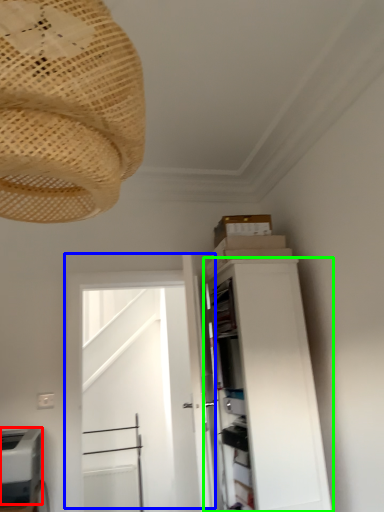
Question: Based on their relative distances, which object is farther from appliance (highlighted by a red box)? Choose from door (highlighted by a blue box) and cabinetry (highlighted by a green box).

Choices:
 (A) door
 (B) cabinetry

Answer: (A)